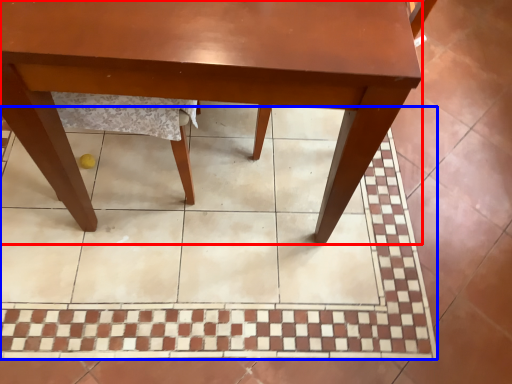
Question: Which object appears closest to the camera in this image, table (highlighted by a red box) or ceramic tile (highlighted by a blue box)?

Choices:
 (A) table
 (B) ceramic tile

Answer: (A)